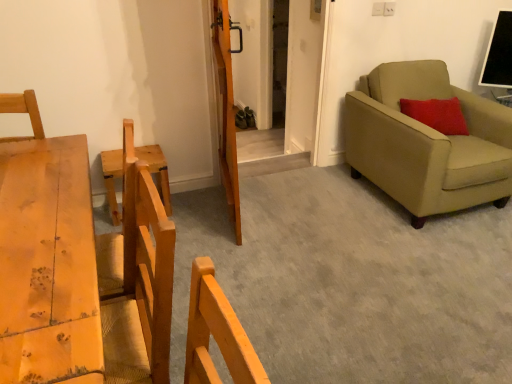
Image resolution: width=512 pixels, height=384 pixels. I want to click on free spot to the left of beige fabric armchair at right, so click(x=317, y=200).